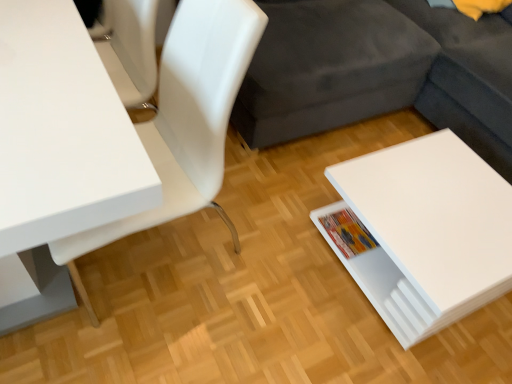
Image resolution: width=512 pixels, height=384 pixels. Find the location of `vacant area that is in front of white glossy table at lower right, marked as the 2th table in a left-to-right arrangement`. vacant area that is in front of white glossy table at lower right, marked as the 2th table in a left-to-right arrangement is located at coordinates (402, 351).